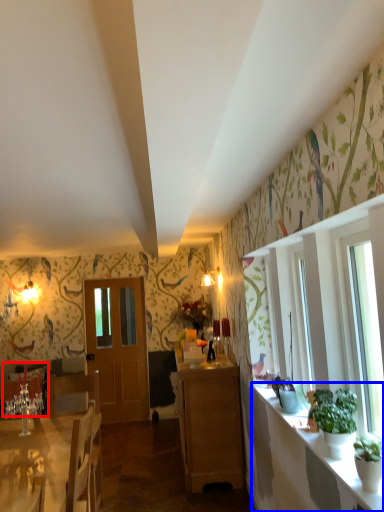
Question: Which of the following is the farthest to the observer, armchair (highlighted by a red box) or counter top (highlighted by a blue box)?

Choices:
 (A) armchair
 (B) counter top

Answer: (A)